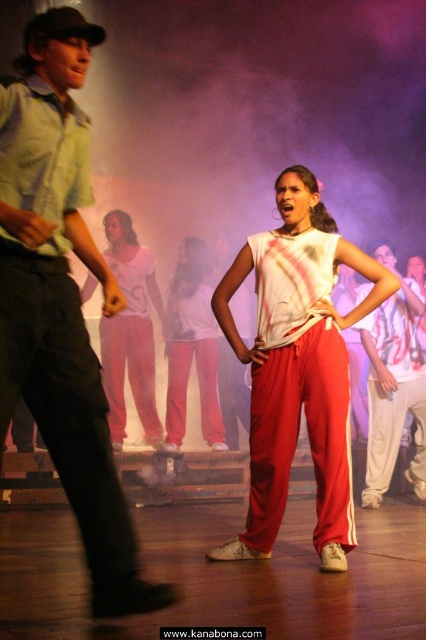
Question: Which point is farther to the camera?

Choices:
 (A) matte white tank top at center
 (B) brushed metal shirt at left
 (C) white matte tank top at center
 (D) white matte shirt at center

Answer: (A)

Question: Which object is farther from the camera taking this photo?

Choices:
 (A) white matte pants at center
 (B) brushed metal shirt at left
 (C) matte white tank top at center
 (D) black cotton pants at left

Answer: (C)

Question: Which object is positioned farthest from the white matte pants at center?

Choices:
 (A) white matte tank top at center
 (B) matte red track pants at center
 (C) white cotton pants at right
 (D) brushed metal shirt at left

Answer: (D)

Question: Does white matte tank top at center have a greater width compared to white matte pants at center?

Choices:
 (A) yes
 (B) no

Answer: (A)

Question: Observing the image, what is the correct spatial positioning of brushed metal shirt at left in reference to black cotton pants at left?

Choices:
 (A) below
 (B) above

Answer: (B)

Question: Does matte red track pants at center lie in front of white matte pants at center?

Choices:
 (A) no
 (B) yes

Answer: (B)